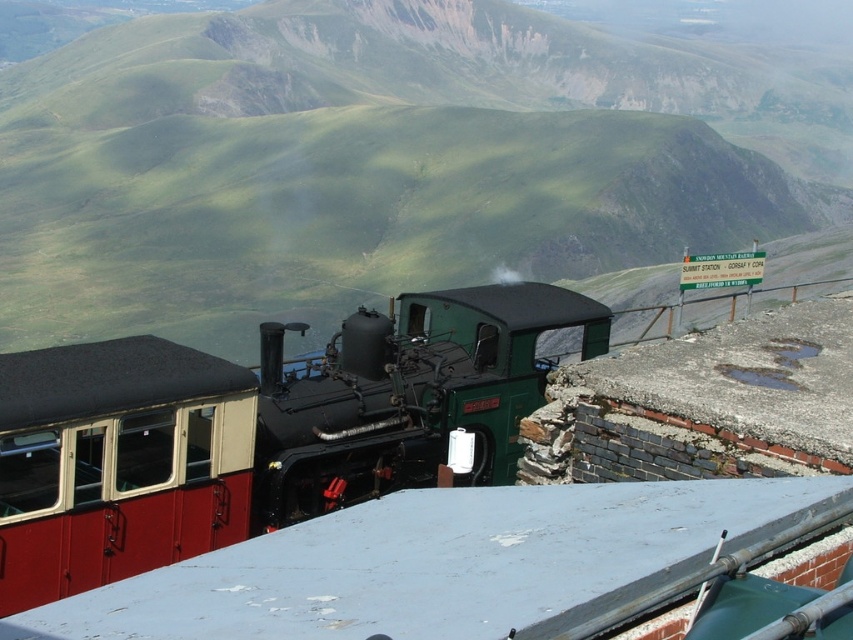
You are standing at the summit station of the Snowdon Mountain Railway and want to take a photo of the red polished wood train car at lower left. Where should you position yourself to ensure it fits perfectly in your camera frame?

To capture the red polished wood train car at lower left in your camera frame, position yourself at the coordinates corresponding to point 0.723 on the x and 0.138 on the y axis, which is the location of the train car.

You are standing at the summit station of the Snowdon Mountain Railway and want to take a photo of the red polished wood train at center. If your camera has a maximum focus range of 10 meters, will you need to move closer to capture a clear image?

The red polished wood train at center is 11.37 meters away from the viewer. Since the camera can only focus up to 10 meters, you need to move closer to ensure the train is within the focus range.

You are a photographer planning to capture a photo of the red polished wood train at center and the green polished metal steam engine at center from the summit station. Which object should you focus on first if you want to highlight the taller one in your composition?

The red polished wood train at center is taller than the green polished metal steam engine at center, so you should focus on the red polished wood train at center to highlight its height in the composition.